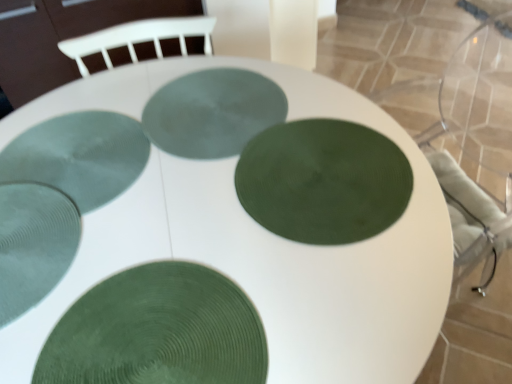
Find the location of a particular element. Image resolution: width=512 pixels, height=384 pixels. vacant space situated above green textured glass plate at center, positioned as the 3th glass plate in back-to-front order (from a real-world perspective) is located at coordinates (323, 176).